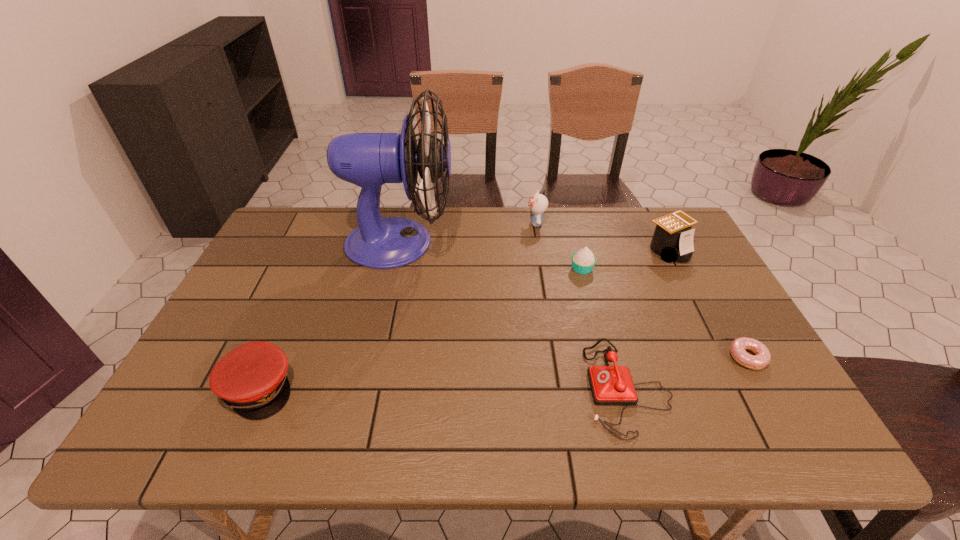
Image resolution: width=960 pixels, height=540 pixels. What are the coordinates of `calculator that is positioned at the far edge` in the screenshot? It's located at (673, 238).

The height and width of the screenshot is (540, 960). I want to click on cap that is at the near edge, so click(x=251, y=379).

The height and width of the screenshot is (540, 960). Find the location of `telephone that is at the near edge`. telephone that is at the near edge is located at coordinates (610, 385).

Where is `object positioned at the left edge`? object positioned at the left edge is located at coordinates (251, 379).

Identify the location of calculator at the right edge. (673, 238).

Image resolution: width=960 pixels, height=540 pixels. I want to click on doughnut located at the right edge, so click(x=738, y=347).

Where is `object present at the near left corner`? This screenshot has height=540, width=960. object present at the near left corner is located at coordinates (251, 379).

What are the coordinates of `object at the far right corner` in the screenshot? It's located at (673, 238).

In the image, there is a desktop. Where is `blank space at the far edge`? Image resolution: width=960 pixels, height=540 pixels. blank space at the far edge is located at coordinates (323, 244).

What are the coordinates of `vacant point at the near edge` in the screenshot? It's located at (291, 415).